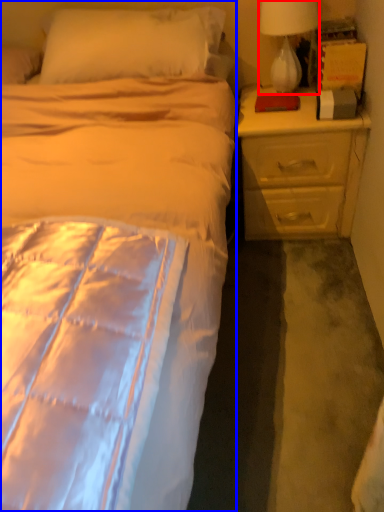
Question: Which point is further to the camera, lamp (highlighted by a red box) or bed (highlighted by a blue box)?

Choices:
 (A) lamp
 (B) bed

Answer: (A)